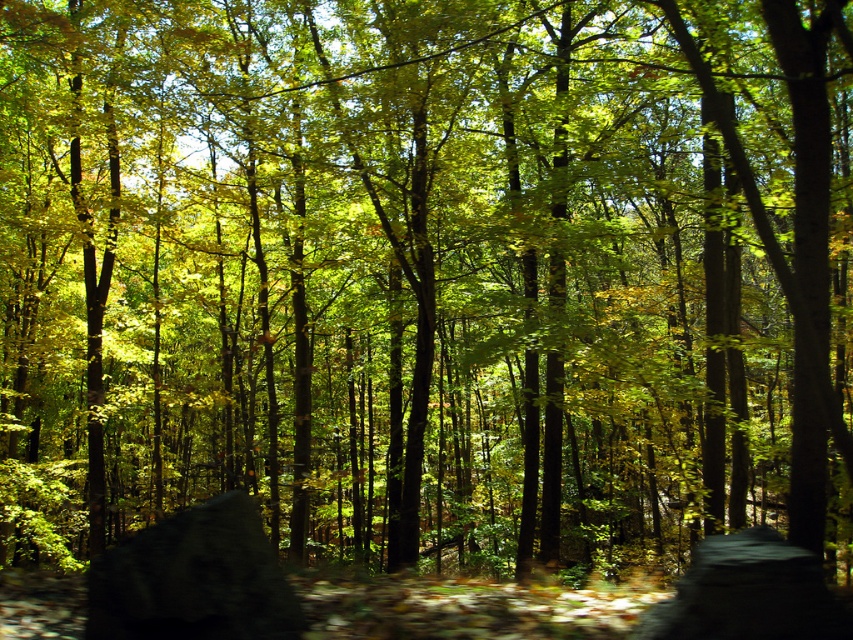
Question: Is dark gray rock at lower center smaller than gray rough stone at center?

Choices:
 (A) no
 (B) yes

Answer: (A)

Question: Can you confirm if dark gray rock at lower center is positioned below gray rough stone at center?

Choices:
 (A) no
 (B) yes

Answer: (A)

Question: Which point is closer to the camera?

Choices:
 (A) gray rough stone at center
 (B) dark gray rock at lower center

Answer: (A)

Question: Is the position of dark gray rock at lower center less distant than that of gray rough stone at center?

Choices:
 (A) yes
 (B) no

Answer: (B)